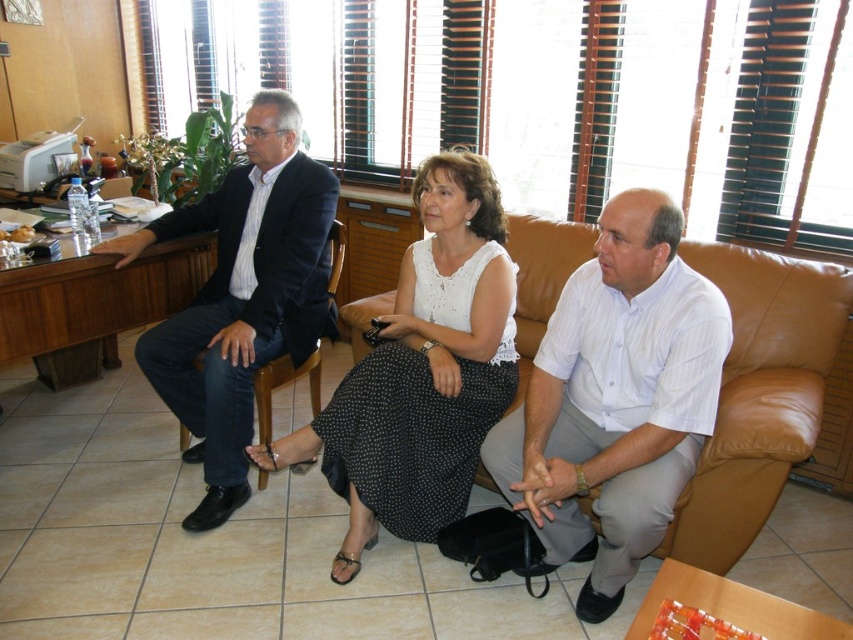
Which is behind, point (578, 323) or point (410, 321)?

The point (410, 321) is behind.

The image size is (853, 640). Find the location of `white striped shirt at center`. white striped shirt at center is located at coordinates (614, 400).

This screenshot has height=640, width=853. Identify the location of white striped shirt at center. pos(614,400).

Identify the location of white dotted fabric skirt at center. This screenshot has height=640, width=853. (421, 371).

Does white dotted fabric skirt at center have a greater width compared to brown leather couch at center?

In fact, white dotted fabric skirt at center might be narrower than brown leather couch at center.

The image size is (853, 640). Find the location of `white dotted fabric skirt at center`. white dotted fabric skirt at center is located at coordinates (421, 371).

Where is `white dotted fabric skirt at center`? The image size is (853, 640). white dotted fabric skirt at center is located at coordinates (421, 371).

You are a GUI agent. You are given a task and a screenshot of the screen. Output one action in this format:
    pyautogui.click(x=<x>, y=<y>)
    Task: Click on the white dotted fabric skirt at center
    The width and height of the screenshot is (853, 640).
    Given the screenshot: What is the action you would take?
    pyautogui.click(x=421, y=371)

Is white dotted fabric skirt at center below matte black suit at left?

Correct, white dotted fabric skirt at center is located below matte black suit at left.

Identify the location of white dotted fabric skirt at center. The width and height of the screenshot is (853, 640). (421, 371).